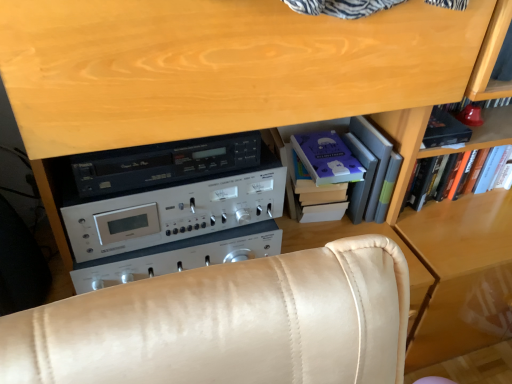
Question: Does hardcover book at upper right have a greater width compared to purple matte paper at center, arranged as the first paperback book when viewed from the left?

Choices:
 (A) yes
 (B) no

Answer: (B)

Question: From the image's perspective, does hardcover book at upper right appear higher than purple matte paper at center, arranged as the first paperback book when viewed from the left?

Choices:
 (A) no
 (B) yes

Answer: (A)

Question: Is purple matte paper at center, arranged as the first paperback book when viewed from the left, at the back of hardcover book at upper right?

Choices:
 (A) no
 (B) yes

Answer: (A)

Question: From a real-world perspective, does hardcover book at upper right stand above purple matte paper at center, the second paperback book in the right-to-left sequence?

Choices:
 (A) no
 (B) yes

Answer: (A)

Question: Is hardcover book at upper right further to the viewer compared to purple matte paper at center, the second paperback book in the right-to-left sequence?

Choices:
 (A) yes
 (B) no

Answer: (A)

Question: In terms of height, does matte purple paperback book at upper right, the 1th paperback book in the right-to-left sequence, look taller or shorter compared to purple matte paper at center, arranged as the first paperback book when viewed from the left?

Choices:
 (A) short
 (B) tall

Answer: (A)

Question: Relative to purple matte paper at center, the second paperback book in the right-to-left sequence, is matte purple paperback book at upper right, arranged as the second paperback book when viewed from the left, in front or behind?

Choices:
 (A) behind
 (B) front

Answer: (A)

Question: Do you think matte purple paperback book at upper right, the 1th paperback book in the right-to-left sequence, is within purple matte paper at center, the second paperback book in the right-to-left sequence, or outside of it?

Choices:
 (A) outside
 (B) inside

Answer: (A)

Question: In terms of width, does matte purple paperback book at upper right, arranged as the second paperback book when viewed from the left, look wider or thinner when compared to purple matte paper at center, arranged as the first paperback book when viewed from the left?

Choices:
 (A) thin
 (B) wide

Answer: (A)

Question: From a real-world perspective, is silver metallic stereo at center physically located above or below hardcover book at upper right?

Choices:
 (A) above
 (B) below

Answer: (A)

Question: Is silver metallic stereo at center to the left or to the right of hardcover book at upper right in the image?

Choices:
 (A) right
 (B) left

Answer: (B)

Question: Considering their positions, is silver metallic stereo at center located in front of or behind hardcover book at upper right?

Choices:
 (A) front
 (B) behind

Answer: (A)

Question: Considering the positions of point tap(240, 256) and point tap(472, 157), is point tap(240, 256) closer or farther from the camera than point tap(472, 157)?

Choices:
 (A) farther
 (B) closer

Answer: (B)

Question: In terms of height, does silver metallic stereo at center look taller or shorter compared to wooden bookshelf at right, the 2th shelf positioned from the left?

Choices:
 (A) short
 (B) tall

Answer: (A)

Question: In the image, is silver metallic stereo at center positioned in front of or behind wooden bookshelf at right, which is counted as the 1th shelf, starting from the right?

Choices:
 (A) front
 (B) behind

Answer: (A)